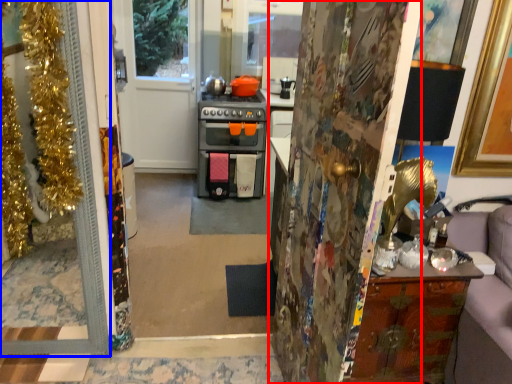
Question: Which point is further to the camera, door (highlighted by a red box) or door (highlighted by a blue box)?

Choices:
 (A) door
 (B) door

Answer: (B)